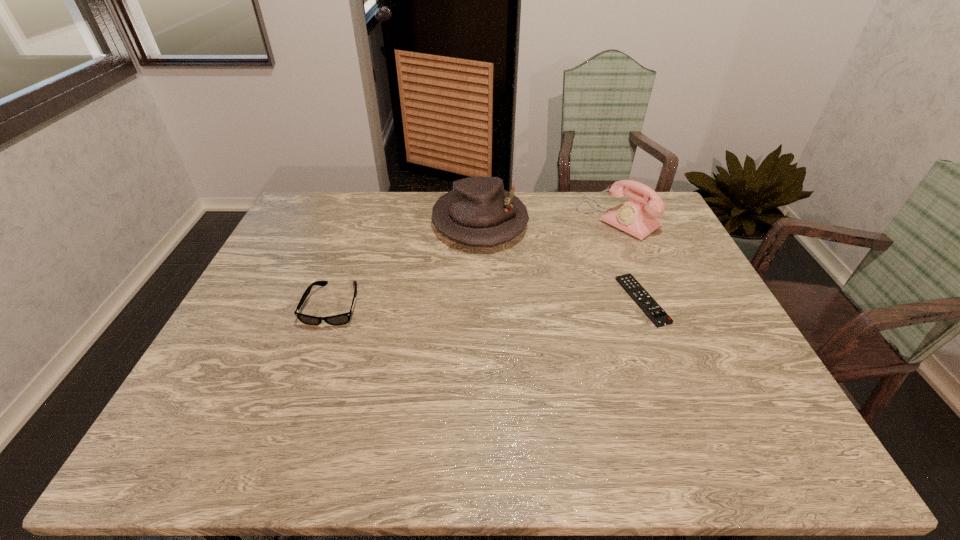
This screenshot has height=540, width=960. Identify the location of vacant point located between the second shortest object and the third object from right to left. (407, 263).

Locate an element on the screen. empty space that is in between the second shortest object and the second object from left to right is located at coordinates (407, 263).

At what (x,y) coordinates should I click in order to perform the action: click on free space between the third object from right to left and the second shortest object. Please return your answer as a coordinate pair (x, y). Image resolution: width=960 pixels, height=540 pixels. Looking at the image, I should click on (407, 263).

Where is `unoccupied area between the telephone and the sunglasses`? This screenshot has height=540, width=960. unoccupied area between the telephone and the sunglasses is located at coordinates (476, 262).

You are a GUI agent. You are given a task and a screenshot of the screen. Output one action in this format:
    pyautogui.click(x=<x>, y=<y>)
    Task: Click on the object identified as the second closest to the telephone
    
    Given the screenshot: What is the action you would take?
    pyautogui.click(x=478, y=211)

The width and height of the screenshot is (960, 540). I want to click on the third closest object relative to the second shortest object, so click(634, 289).

You are a GUI agent. You are given a task and a screenshot of the screen. Output one action in this format:
    pyautogui.click(x=<x>, y=<y>)
    Task: Click on the free space that satisfies the following two spatial constraints: 1. on the back side of the hat; 2. on the left side of the telephone
    The image size is (960, 540).
    Given the screenshot: What is the action you would take?
    pyautogui.click(x=480, y=219)